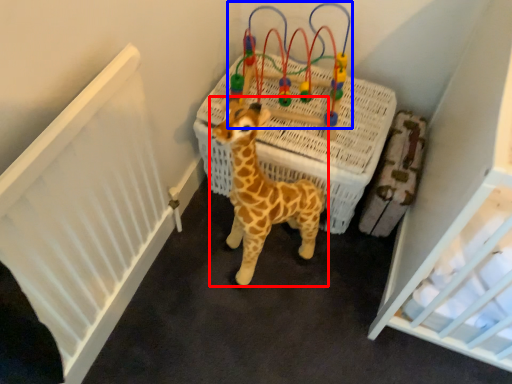
Question: Which object is closer to the camera taking this photo, giraffe (highlighted by a red box) or toy (highlighted by a blue box)?

Choices:
 (A) giraffe
 (B) toy

Answer: (A)